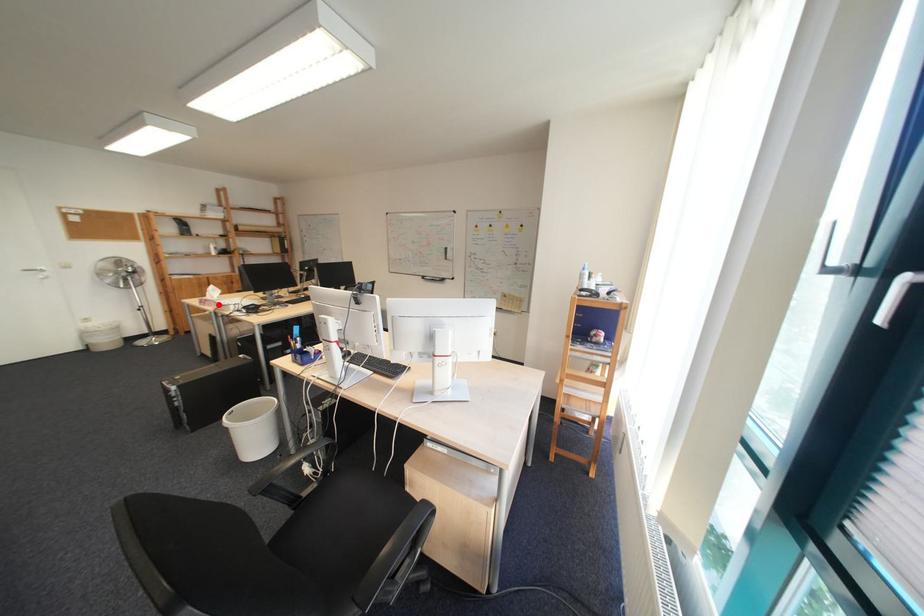
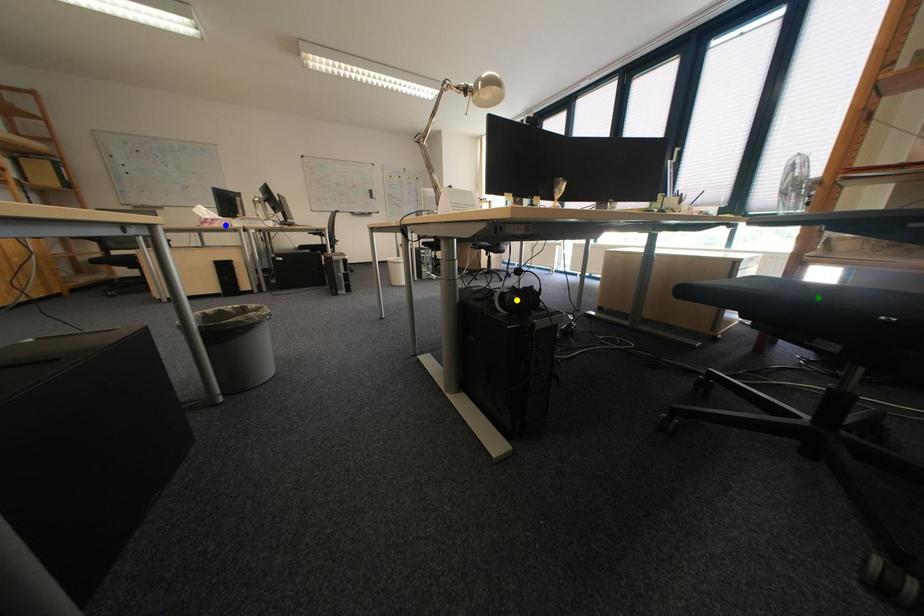
Question: I am providing you with two images of the same scene from different viewpoints. A red point is marked on the first image. You are given multiple points on the second image. Which spot in image 2 lines up with the point in image 1?

Choices:
 (A) yellow point
 (B) green point
 (C) blue point

Answer: (C)